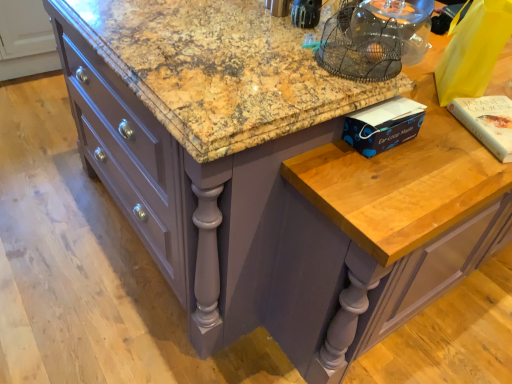
Measure the distance between point (499,110) and camera.

The depth of point (499,110) is 1.24 meters.

The image size is (512, 384). I want to click on white paper book at upper right, the first book when ordered from right to left, so click(x=487, y=122).

Describe the element at coordinates (487, 122) in the screenshot. This screenshot has width=512, height=384. I see `white paper book at upper right, the first book when ordered from right to left` at that location.

Where is `blue paper ear-loop masks at right, marked as the first book in a left-to-right arrangement`? Image resolution: width=512 pixels, height=384 pixels. blue paper ear-loop masks at right, marked as the first book in a left-to-right arrangement is located at coordinates (383, 125).

Describe the element at coordinates (383, 125) in the screenshot. This screenshot has height=384, width=512. I see `blue paper ear-loop masks at right, marked as the first book in a left-to-right arrangement` at that location.

Image resolution: width=512 pixels, height=384 pixels. Identify the location of white paper book at upper right, the first book when ordered from right to left. (487, 122).

Can you confirm if blue paper ear-loop masks at right, which is counted as the second book, starting from the right, is positioned to the right of white paper book at upper right, the first book when ordered from right to left?

Incorrect, blue paper ear-loop masks at right, which is counted as the second book, starting from the right, is not on the right side of white paper book at upper right, the first book when ordered from right to left.

Does blue paper ear-loop masks at right, marked as the first book in a left-to-right arrangement, lie behind white paper book at upper right, the first book when ordered from right to left?

No, blue paper ear-loop masks at right, marked as the first book in a left-to-right arrangement, is closer to the viewer.

Considering the points (352, 127) and (496, 143), which point is in front, point (352, 127) or point (496, 143)?

The point (352, 127) is closer.

From the image's perspective, which is below, blue paper ear-loop masks at right, marked as the first book in a left-to-right arrangement, or white paper book at upper right, the second book when ordered from left to right?

blue paper ear-loop masks at right, marked as the first book in a left-to-right arrangement, appears lower in the image.

From a real-world perspective, is blue paper ear-loop masks at right, which is counted as the second book, starting from the right, located higher than white paper book at upper right, the second book when ordered from left to right?

Correct, in the physical world, blue paper ear-loop masks at right, which is counted as the second book, starting from the right, is higher than white paper book at upper right, the second book when ordered from left to right.

Which object is thinner, blue paper ear-loop masks at right, marked as the first book in a left-to-right arrangement, or white paper book at upper right, the second book when ordered from left to right?

Thinner between the two is blue paper ear-loop masks at right, marked as the first book in a left-to-right arrangement.

Can you confirm if blue paper ear-loop masks at right, marked as the first book in a left-to-right arrangement, is shorter than white paper book at upper right, the first book when ordered from right to left?

In fact, blue paper ear-loop masks at right, marked as the first book in a left-to-right arrangement, may be taller than white paper book at upper right, the first book when ordered from right to left.

Between blue paper ear-loop masks at right, which is counted as the second book, starting from the right, and white paper book at upper right, the first book when ordered from right to left, which one has larger size?

blue paper ear-loop masks at right, which is counted as the second book, starting from the right, is bigger.

Is white paper book at upper right, the first book when ordered from right to left, a part of blue paper ear-loop masks at right, marked as the first book in a left-to-right arrangement?

No, blue paper ear-loop masks at right, marked as the first book in a left-to-right arrangement, does not contain white paper book at upper right, the first book when ordered from right to left.

Does blue paper ear-loop masks at right, marked as the first book in a left-to-right arrangement, touch white paper book at upper right, the second book when ordered from left to right?

No, blue paper ear-loop masks at right, marked as the first book in a left-to-right arrangement, is not with white paper book at upper right, the second book when ordered from left to right.

Is blue paper ear-loop masks at right, which is counted as the second book, starting from the right, facing away from white paper book at upper right, the first book when ordered from right to left?

Yes, blue paper ear-loop masks at right, which is counted as the second book, starting from the right,'s orientation is away from white paper book at upper right, the first book when ordered from right to left.

How different are the orientations of blue paper ear-loop masks at right, marked as the first book in a left-to-right arrangement, and white paper book at upper right, the first book when ordered from right to left, in degrees?

The angular difference between blue paper ear-loop masks at right, marked as the first book in a left-to-right arrangement, and white paper book at upper right, the first book when ordered from right to left, is 113 degrees.

Based on the photo, how distant is blue paper ear-loop masks at right, marked as the first book in a left-to-right arrangement, from white paper book at upper right, the first book when ordered from right to left?

A distance of 10.54 inches exists between blue paper ear-loop masks at right, marked as the first book in a left-to-right arrangement, and white paper book at upper right, the first book when ordered from right to left.

You are a GUI agent. You are given a task and a screenshot of the screen. Output one action in this format:
    pyautogui.click(x=<x>, y=<y>)
    Task: Click on the book above the blue paper ear-loop masks at right, which is counted as the second book, starting from the right (from the image's perspective)
    The image size is (512, 384).
    Given the screenshot: What is the action you would take?
    pyautogui.click(x=487, y=122)

Does white paper book at upper right, the second book when ordered from left to right, appear on the left side of blue paper ear-loop masks at right, which is counted as the second book, starting from the right?

No.

Which object is closer to the camera, white paper book at upper right, the second book when ordered from left to right, or blue paper ear-loop masks at right, which is counted as the second book, starting from the right?

blue paper ear-loop masks at right, which is counted as the second book, starting from the right, is in front.

Considering the positions of point (497, 141) and point (348, 138), is point (497, 141) closer or farther from the camera than point (348, 138)?

Point (497, 141) appears to be farther away from the viewer than point (348, 138).

From the image's perspective, is white paper book at upper right, the first book when ordered from right to left, under blue paper ear-loop masks at right, marked as the first book in a left-to-right arrangement?

No.

From a real-world perspective, is white paper book at upper right, the second book when ordered from left to right, above or below blue paper ear-loop masks at right, marked as the first book in a left-to-right arrangement?

Clearly, from a real-world perspective, white paper book at upper right, the second book when ordered from left to right, is below blue paper ear-loop masks at right, marked as the first book in a left-to-right arrangement.

Is white paper book at upper right, the second book when ordered from left to right, wider than blue paper ear-loop masks at right, which is counted as the second book, starting from the right?

Yes.

Between white paper book at upper right, the second book when ordered from left to right, and blue paper ear-loop masks at right, marked as the first book in a left-to-right arrangement, which one has less height?

white paper book at upper right, the second book when ordered from left to right.

Who is smaller, white paper book at upper right, the second book when ordered from left to right, or blue paper ear-loop masks at right, which is counted as the second book, starting from the right?

white paper book at upper right, the second book when ordered from left to right.

Is white paper book at upper right, the first book when ordered from right to left, positioned beyond the bounds of blue paper ear-loop masks at right, which is counted as the second book, starting from the right?

Yes, white paper book at upper right, the first book when ordered from right to left, is not within blue paper ear-loop masks at right, which is counted as the second book, starting from the right.

Would you consider white paper book at upper right, the second book when ordered from left to right, to be distant from blue paper ear-loop masks at right, marked as the first book in a left-to-right arrangement?

No, white paper book at upper right, the second book when ordered from left to right, is not far from blue paper ear-loop masks at right, marked as the first book in a left-to-right arrangement.

Is white paper book at upper right, the second book when ordered from left to right, aimed at blue paper ear-loop masks at right, which is counted as the second book, starting from the right?

No, white paper book at upper right, the second book when ordered from left to right, is not aimed at blue paper ear-loop masks at right, which is counted as the second book, starting from the right.

Locate an element on the screen. book on the right of the blue paper ear-loop masks at right, which is counted as the second book, starting from the right is located at coordinates (487, 122).

At what (x,y) coordinates should I click in order to perform the action: click on book that is above the white paper book at upper right, the first book when ordered from right to left (from a real-world perspective). Please return your answer as a coordinate pair (x, y). Looking at the image, I should click on (383, 125).

Identify the location of book located above the blue paper ear-loop masks at right, which is counted as the second book, starting from the right (from the image's perspective). (487, 122).